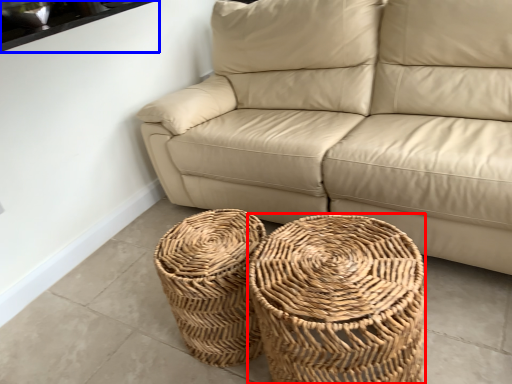
Question: Which of the following is the farthest to the observer, basket (highlighted by a red box) or window sill (highlighted by a blue box)?

Choices:
 (A) basket
 (B) window sill

Answer: (B)